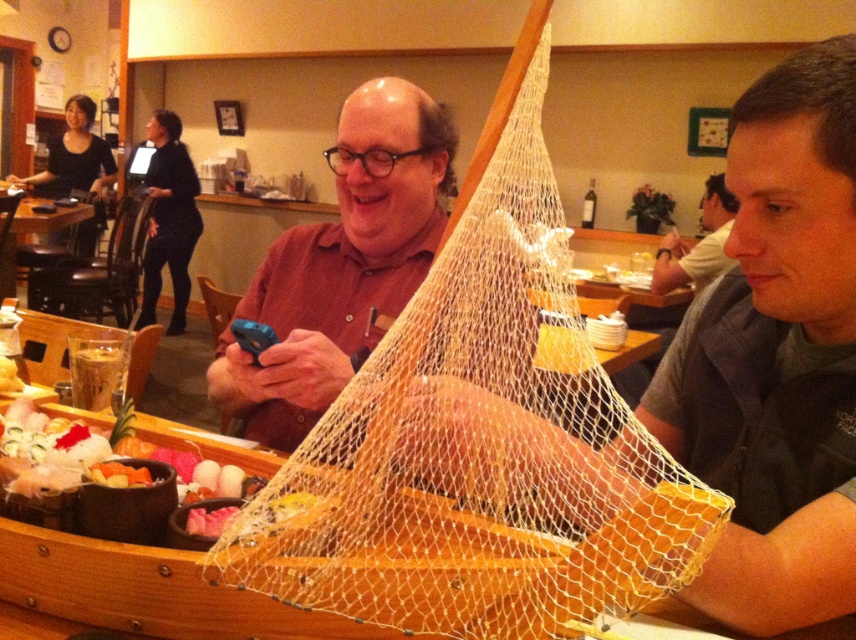
Between white mesh net at center and matte brown shirt at center, which one has more height?

matte brown shirt at center is taller.

Does point (575, 458) come farther from viewer compared to point (381, 298)?

No, it is in front of (381, 298).

Who is more forward, (593,522) or (352,298)?

Point (593,522) is in front.

Locate an element on the screen. This screenshot has width=856, height=640. white mesh net at center is located at coordinates (480, 445).

Does white mesh net at center appear on the right side of gray fabric shirt at right?

In fact, white mesh net at center is to the left of gray fabric shirt at right.

At what (x,y) coordinates should I click in order to perform the action: click on white mesh net at center. Please return your answer as a coordinate pair (x, y). Image resolution: width=856 pixels, height=640 pixels. Looking at the image, I should click on (480, 445).

Does point (583, 346) lie behind point (663, 291)?

No, it is in front of (663, 291).

Where is `white mesh net at center`? The width and height of the screenshot is (856, 640). white mesh net at center is located at coordinates (480, 445).

The width and height of the screenshot is (856, 640). Identify the location of matte brown shirt at center. (342, 264).